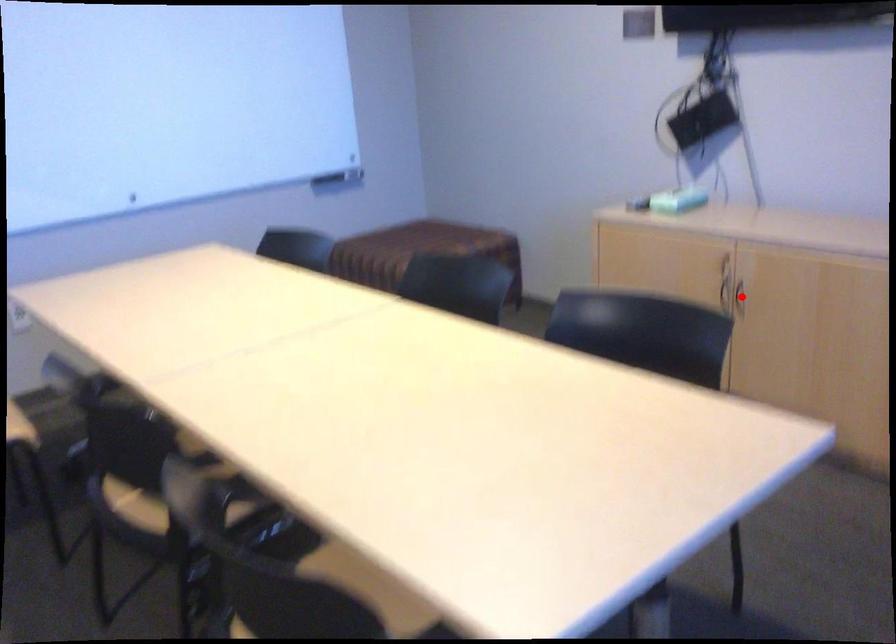
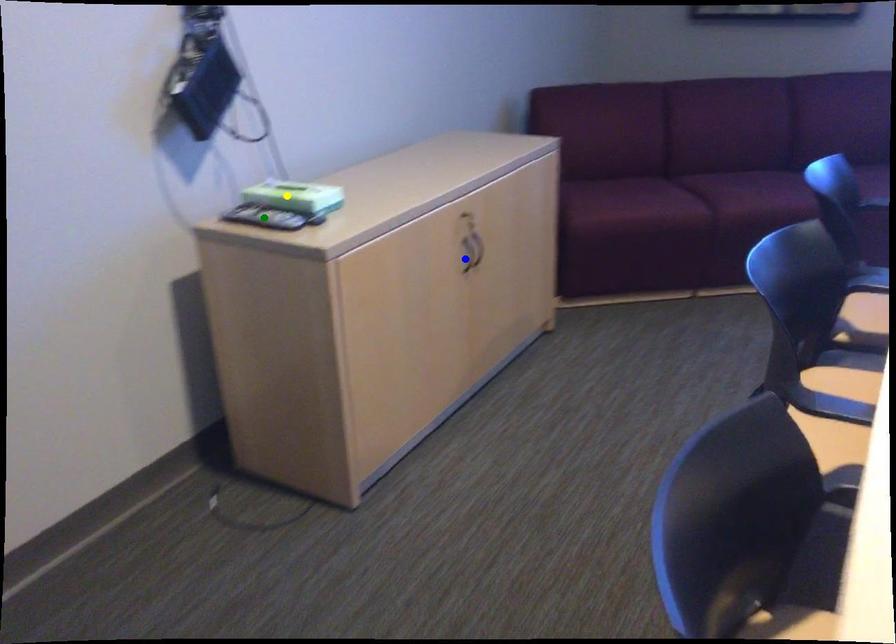
Question: I am providing you with two images of the same scene from different viewpoints. A red point is marked on the first image. You are given multiple points on the second image. Which mark in image 2 goes with the point in image 1?

Choices:
 (A) green point
 (B) yellow point
 (C) blue point

Answer: (C)